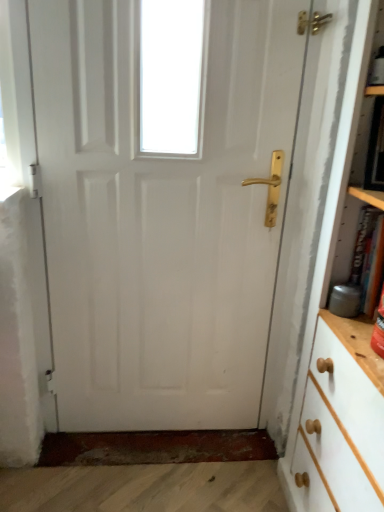
Question: Does white painted wood bookcase at right have a lesser width compared to hardcover book at right?

Choices:
 (A) yes
 (B) no

Answer: (B)

Question: Considering the relative sizes of white painted wood bookcase at right and hardcover book at right in the image provided, is white painted wood bookcase at right smaller than hardcover book at right?

Choices:
 (A) yes
 (B) no

Answer: (B)

Question: Is white painted wood bookcase at right oriented away from hardcover book at right?

Choices:
 (A) yes
 (B) no

Answer: (A)

Question: Is white painted wood bookcase at right outside hardcover book at right?

Choices:
 (A) yes
 (B) no

Answer: (A)

Question: Can you confirm if white painted wood bookcase at right is shorter than hardcover book at right?

Choices:
 (A) yes
 (B) no

Answer: (B)

Question: Visually, is white painted wood bookcase at right positioned to the left or to the right of hardcover book at right?

Choices:
 (A) right
 (B) left

Answer: (A)

Question: Is white painted wood bookcase at right spatially inside hardcover book at right, or outside of it?

Choices:
 (A) inside
 (B) outside

Answer: (B)

Question: Relative to hardcover book at right, is white painted wood bookcase at right in front or behind?

Choices:
 (A) front
 (B) behind

Answer: (A)

Question: In terms of width, does white painted wood bookcase at right look wider or thinner when compared to hardcover book at right?

Choices:
 (A) wide
 (B) thin

Answer: (A)

Question: From the image's perspective, is white glossy door at center above or below hardcover book at right?

Choices:
 (A) below
 (B) above

Answer: (B)

Question: Would you say white glossy door at center is to the left or to the right of hardcover book at right in the picture?

Choices:
 (A) left
 (B) right

Answer: (A)

Question: Considering the positions of point (152, 391) and point (367, 223), is point (152, 391) closer or farther from the camera than point (367, 223)?

Choices:
 (A) closer
 (B) farther

Answer: (B)

Question: From a real-world perspective, relative to hardcover book at right, is white glossy door at center vertically above or below?

Choices:
 (A) above
 (B) below

Answer: (B)

Question: Choose the correct answer: Is white painted wood bookcase at right inside white glossy door at center or outside it?

Choices:
 (A) inside
 (B) outside

Answer: (B)

Question: In terms of width, does white painted wood bookcase at right look wider or thinner when compared to white glossy door at center?

Choices:
 (A) thin
 (B) wide

Answer: (B)